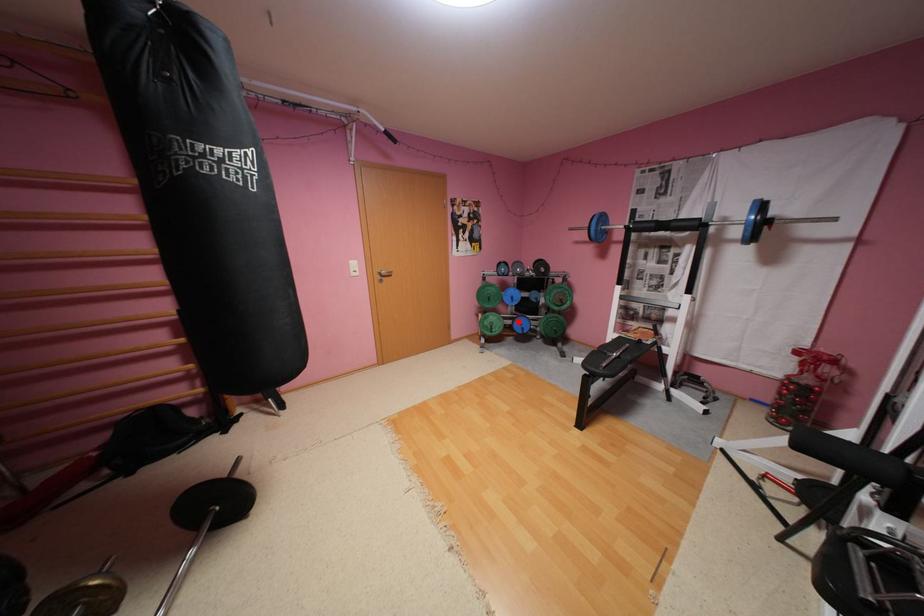
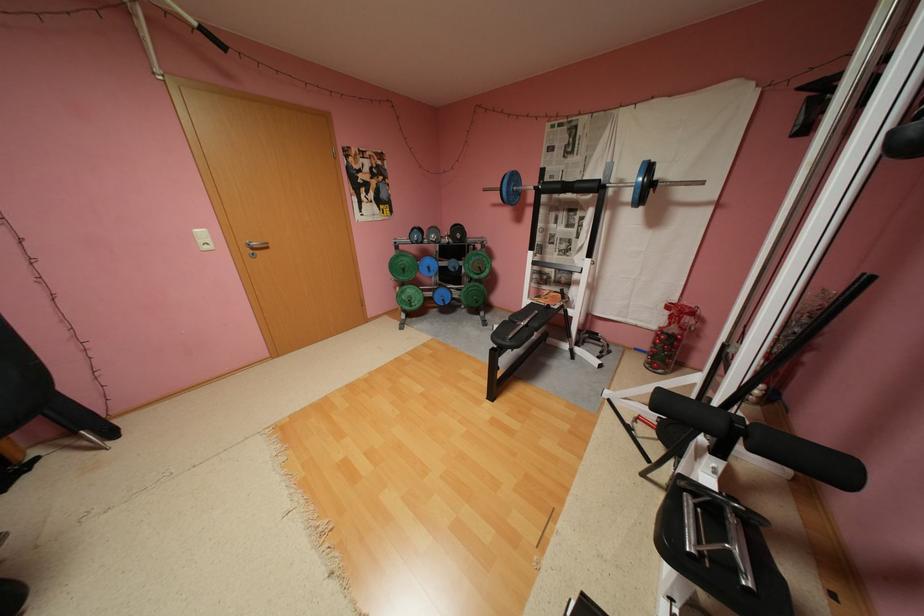
Question: I am providing you with two images of the same scene from different viewpoints. In image1, a red point is highlighted. Considering the same 3D point in image2, which of the following is correct?

Choices:
 (A) It is closer
 (B) It is farther

Answer: (A)